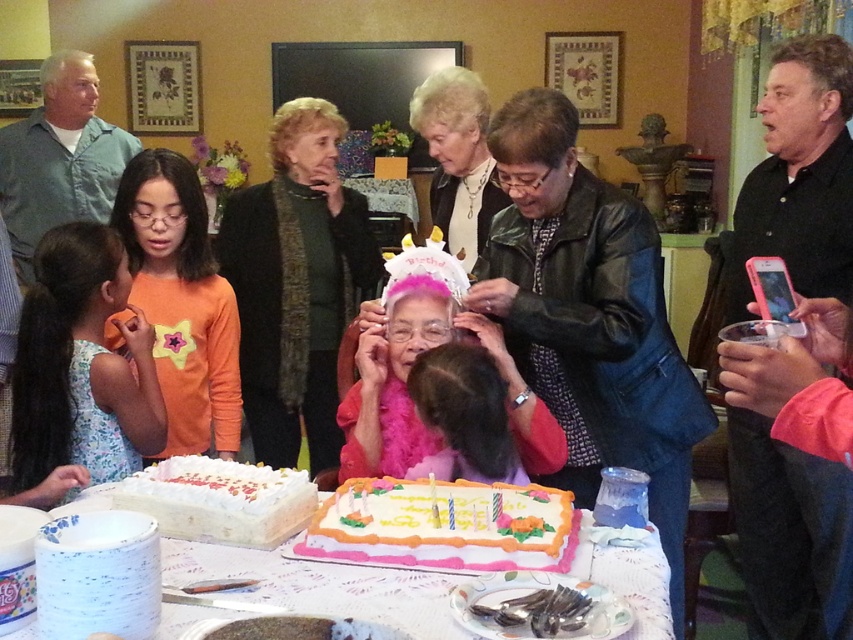
Can you confirm if pink feather boa at center is smaller than white frosted cake with floral decorations at center?

Incorrect, pink feather boa at center is not smaller in size than white frosted cake with floral decorations at center.

Is pink feather boa at center taller than white frosted cake with floral decorations at center?

Yes.

Locate an element on the screen. pink feather boa at center is located at coordinates (412, 362).

The height and width of the screenshot is (640, 853). In order to click on pink feather boa at center in this screenshot , I will do `click(412, 362)`.

Can you confirm if white paper plate at lower center is positioned to the left of pink feather boa at center?

Yes, white paper plate at lower center is to the left of pink feather boa at center.

Is white paper plate at lower center further to camera compared to pink feather boa at center?

No, it is not.

Is point (654, 534) more distant than point (369, 364)?

No.

You are a GUI agent. You are given a task and a screenshot of the screen. Output one action in this format:
    pyautogui.click(x=<x>, y=<y>)
    Task: Click on the white paper plate at lower center
    This screenshot has width=853, height=640.
    Given the screenshot: What is the action you would take?
    pyautogui.click(x=323, y=586)

Can you confirm if floral dress at lower left is positioned to the left of white frosted cake with floral decorations at center?

Correct, you'll find floral dress at lower left to the left of white frosted cake with floral decorations at center.

Does point (38, 328) lie in front of point (399, 554)?

No, it is behind (399, 554).

Is point (91, 356) positioned after point (556, 518)?

Yes.

Find the location of `floral dress at lower left`. floral dress at lower left is located at coordinates (80, 364).